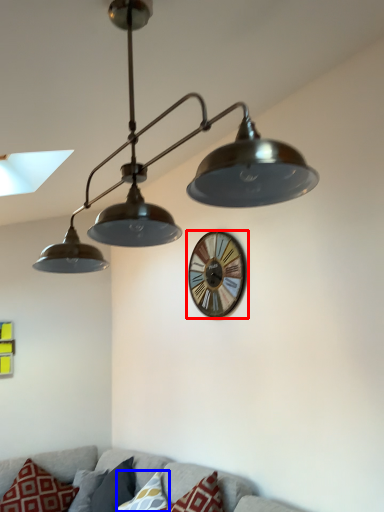
Question: Which point is closer to the camera, wall clock (highlighted by a red box) or pillow (highlighted by a blue box)?

Choices:
 (A) wall clock
 (B) pillow

Answer: (B)